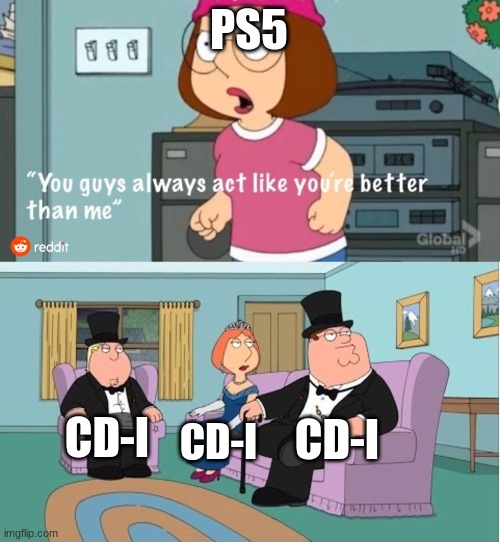
I want to click on door, so click(285, 350).